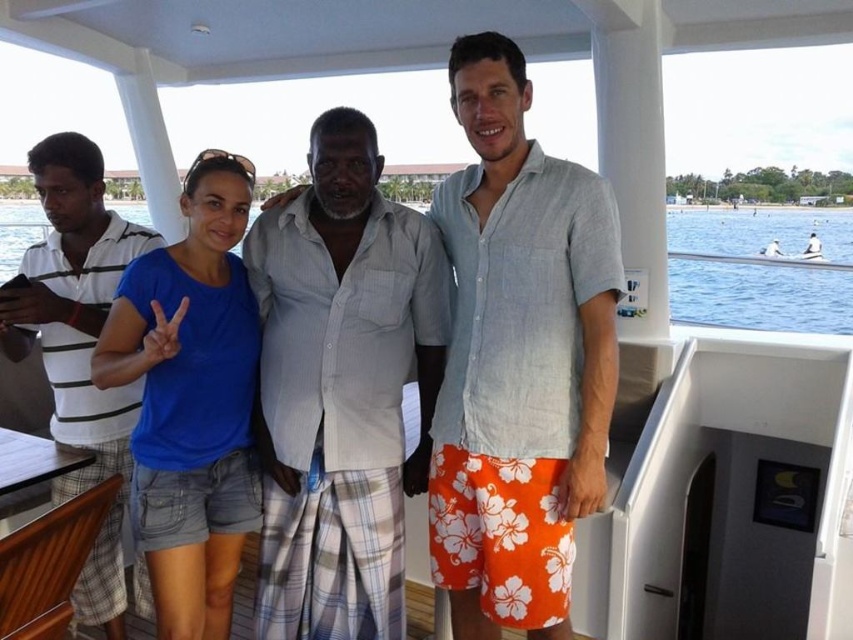
You are standing on the boat deck and want to move from the point at coordinates point (x=91, y=557) to the point at coordinates point (x=131, y=209). Which direction should you move to get closer to the latter point?

To move from point (x=91, y=557) to point (x=131, y=209), you should move backward since point (x=91, y=557) is in front of point (x=131, y=209).

You are a photographer trying to capture the perfect shot of the light blue linen shirt at center. Based on its position coordinates, where should you aim your camera?

The light blue linen shirt at center is located at coordinates point (518, 356), so aim your camera there to capture it.